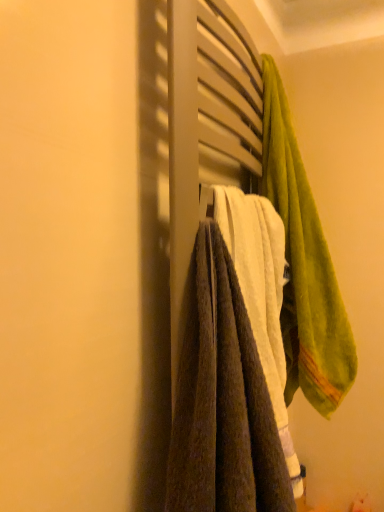
Question: Considering the positions of point (223, 465) and point (296, 220), is point (223, 465) closer or farther from the camera than point (296, 220)?

Choices:
 (A) farther
 (B) closer

Answer: (B)

Question: Considering the positions of brown textured towel at center, the first towel positioned from the left, and green soft towel at upper right, which is counted as the first towel, starting from the right, in the image, is brown textured towel at center, the first towel positioned from the left, wider or thinner than green soft towel at upper right, which is counted as the first towel, starting from the right,?

Choices:
 (A) thin
 (B) wide

Answer: (A)

Question: Is brown textured towel at center, which is the 2th towel from right to left, situated inside green soft towel at upper right, the second towel viewed from the left, or outside?

Choices:
 (A) outside
 (B) inside

Answer: (A)

Question: From a real-world perspective, relative to brown textured towel at center, the first towel positioned from the left, is green soft towel at upper right, the second towel viewed from the left, vertically above or below?

Choices:
 (A) above
 (B) below

Answer: (A)

Question: From the image's perspective, is green soft towel at upper right, the second towel viewed from the left, above or below brown textured towel at center, which is the 2th towel from right to left?

Choices:
 (A) below
 (B) above

Answer: (B)

Question: In terms of size, does green soft towel at upper right, the second towel viewed from the left, appear bigger or smaller than brown textured towel at center, which is the 2th towel from right to left?

Choices:
 (A) big
 (B) small

Answer: (A)

Question: Is green soft towel at upper right, the second towel viewed from the left, spatially inside brown textured towel at center, the first towel positioned from the left, or outside of it?

Choices:
 (A) outside
 (B) inside

Answer: (A)